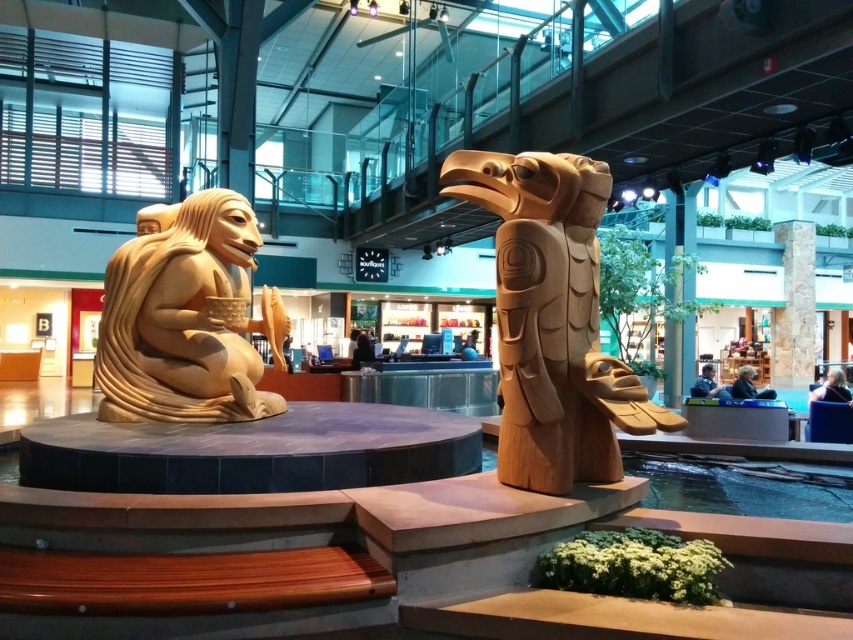
Question: From the image, what is the correct spatial relationship of wooden totem at center in relation to wooden carving at left?

Choices:
 (A) right
 (B) left

Answer: (A)

Question: Which of the following is the closest to the observer?

Choices:
 (A) stone textured pillar at center
 (B) wooden carving at left
 (C) wooden totem at center

Answer: (C)

Question: Does wooden totem at center appear over wooden carving at left?

Choices:
 (A) yes
 (B) no

Answer: (A)

Question: Estimate the real-world distances between objects in this image. Which object is closer to the stone textured pillar at center?

Choices:
 (A) wooden totem at center
 (B) wooden carving at left

Answer: (A)

Question: Is wooden totem at center below stone textured pillar at center?

Choices:
 (A) no
 (B) yes

Answer: (B)

Question: Among these points, which one is farthest from the camera?

Choices:
 (A) (527, 340)
 (B) (189, 276)

Answer: (B)